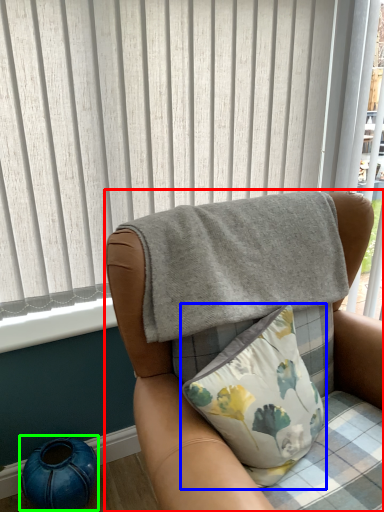
Question: Which is nearer to the chair (highlighted by a red box)? pillow (highlighted by a blue box) or teal (highlighted by a green box).

Choices:
 (A) pillow
 (B) teal

Answer: (A)